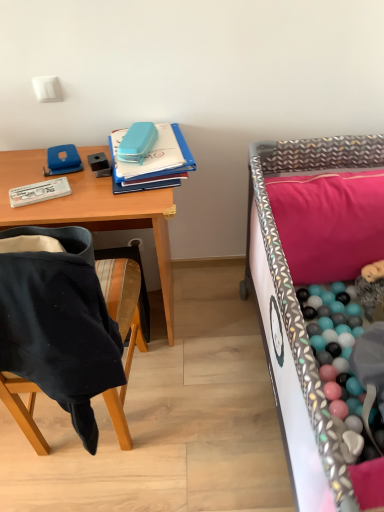
Find the location of a particular element. This screenshot has height=512, width=384. vacant space to the right of wooden desk at upper left is located at coordinates (219, 324).